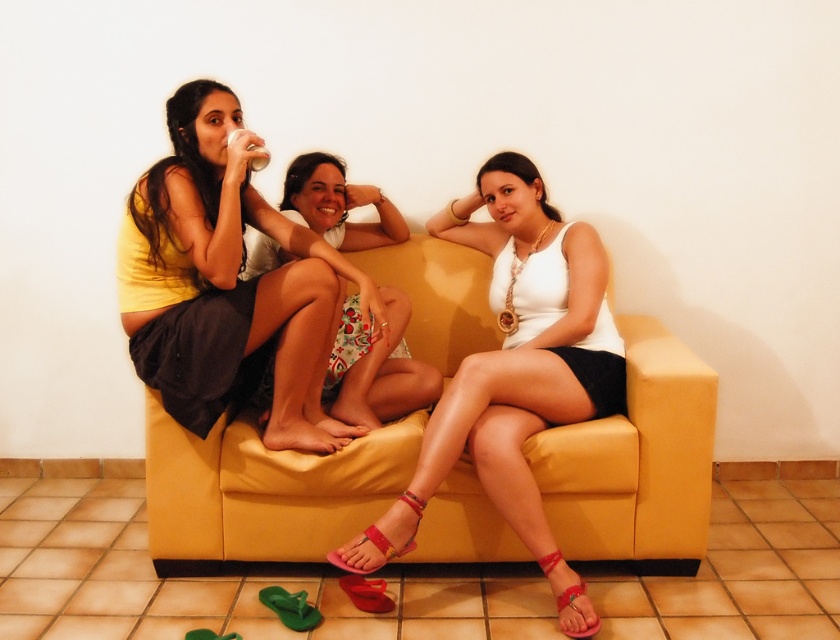
In the scene described, there are two women wearing specific clothing items. The first is wearing a matte yellow dress at upper left, and the second has a white matte tank top at center. Based on their positions, which clothing item is positioned higher in the image?

The matte yellow dress at upper left is located above the white matte tank top at center, so it is positioned higher in the image.

You are a photographer setting up a shoot in the living room. You need to place a small prop between the floral fabric skirt at center and the matte red sandal at lower center. Based on their positions, which side of the sandal should the prop be placed on?

The prop should be placed to the left side of the matte red sandal at lower center since the floral fabric skirt at center is already positioned on its left.